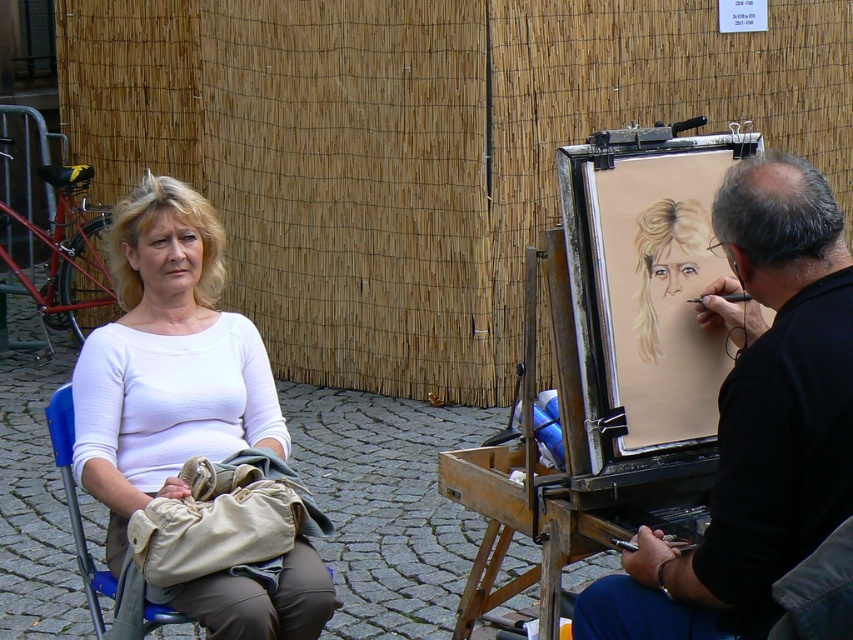
Question: Does white matte shirt at left have a greater width compared to blue plastic chair at lower left?

Choices:
 (A) no
 (B) yes

Answer: (B)

Question: Which point is closer to the camera?

Choices:
 (A) (158, 604)
 (B) (132, 502)
 (C) (711, 285)

Answer: (C)

Question: Among these points, which one is nearest to the camera?

Choices:
 (A) (224, 381)
 (B) (598, 385)
 (C) (82, 540)
 (D) (712, 211)

Answer: (D)

Question: Does smooth black shirt at right have a greater width compared to blue plastic chair at lower left?

Choices:
 (A) no
 (B) yes

Answer: (B)

Question: Is wooden easel at center above white matte shirt at left?

Choices:
 (A) no
 (B) yes

Answer: (A)

Question: Which point is farther to the camera?

Choices:
 (A) (64, 432)
 (B) (705, 326)
 (C) (525, 266)
 (D) (186, 397)

Answer: (C)